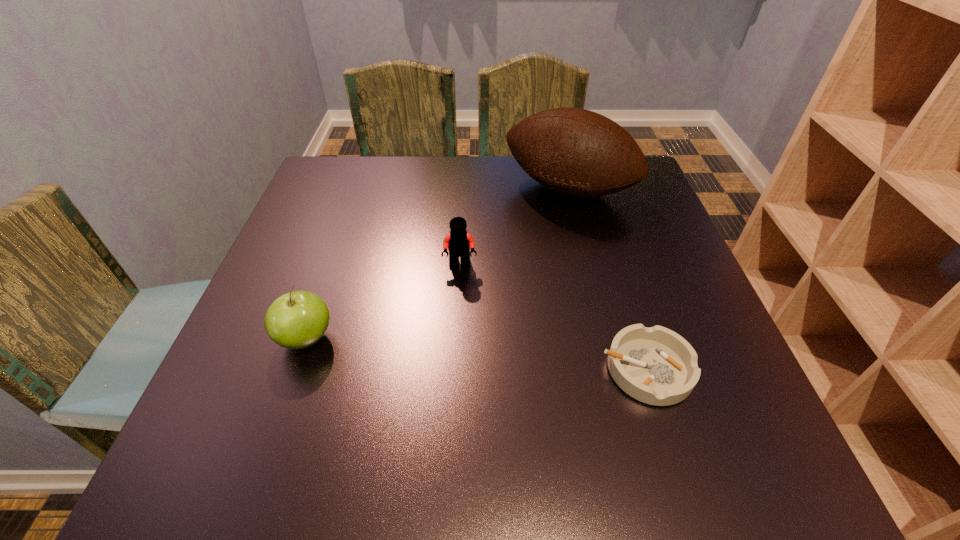
Locate an element on the screen. The image size is (960, 540). free spot that satisfies the following two spatial constraints: 1. on the back side of the leftmost object; 2. on the right side of the tallest object is located at coordinates (358, 190).

Locate an element on the screen. free location that satisfies the following two spatial constraints: 1. on the back side of the third nearest object; 2. on the left side of the football is located at coordinates (464, 190).

Where is `free point that satisfies the following two spatial constraints: 1. on the back side of the farthest object; 2. on the left side of the apple`? This screenshot has width=960, height=540. free point that satisfies the following two spatial constraints: 1. on the back side of the farthest object; 2. on the left side of the apple is located at coordinates (358, 190).